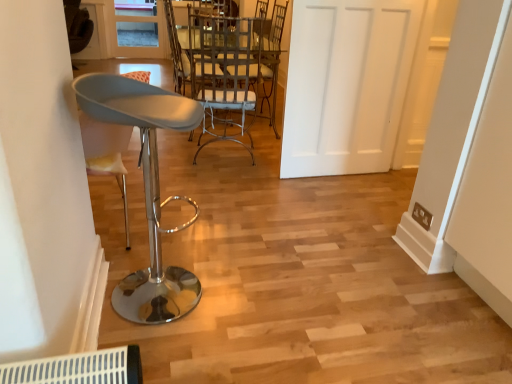
Question: From a real-world perspective, is white matte door at center located higher than clear glass door at upper center?

Choices:
 (A) no
 (B) yes

Answer: (B)

Question: From the image's perspective, is white matte door at center below clear glass door at upper center?

Choices:
 (A) yes
 (B) no

Answer: (A)

Question: Is white matte door at center positioned behind clear glass door at upper center?

Choices:
 (A) no
 (B) yes

Answer: (A)

Question: Is white matte door at center turned away from clear glass door at upper center?

Choices:
 (A) yes
 (B) no

Answer: (A)

Question: Does white matte door at center have a smaller size compared to clear glass door at upper center?

Choices:
 (A) no
 (B) yes

Answer: (A)

Question: In terms of width, does white matte door at center look wider or thinner when compared to white fabric chair at center, which is the 1th chair in back-to-front order?

Choices:
 (A) thin
 (B) wide

Answer: (A)

Question: From the image's perspective, is white matte door at center above or below white fabric chair at center, the second chair from the front?

Choices:
 (A) above
 (B) below

Answer: (B)

Question: Is white matte door at center taller or shorter than white fabric chair at center, the second chair from the front?

Choices:
 (A) short
 (B) tall

Answer: (B)

Question: Choose the correct answer: Is white matte door at center inside white fabric chair at center, which is the 1th chair in back-to-front order, or outside it?

Choices:
 (A) inside
 (B) outside

Answer: (B)

Question: Considering the positions of point (130, 36) and point (268, 19), is point (130, 36) closer or farther from the camera than point (268, 19)?

Choices:
 (A) farther
 (B) closer

Answer: (A)

Question: Is clear glass door at upper center spatially inside white fabric chair at center, the second chair from the front, or outside of it?

Choices:
 (A) inside
 (B) outside

Answer: (B)

Question: Is clear glass door at upper center wider or thinner than white fabric chair at center, which is the 1th chair in back-to-front order?

Choices:
 (A) thin
 (B) wide

Answer: (A)

Question: From their relative heights in the image, would you say clear glass door at upper center is taller or shorter than white fabric chair at center, the second chair from the front?

Choices:
 (A) short
 (B) tall

Answer: (A)

Question: Is matte gray stool at left, which appears as the first chair when viewed from the front, taller or shorter than white matte door at center?

Choices:
 (A) tall
 (B) short

Answer: (B)

Question: Is matte gray stool at left, which appears as the first chair when viewed from the front, wider or thinner than white matte door at center?

Choices:
 (A) wide
 (B) thin

Answer: (A)